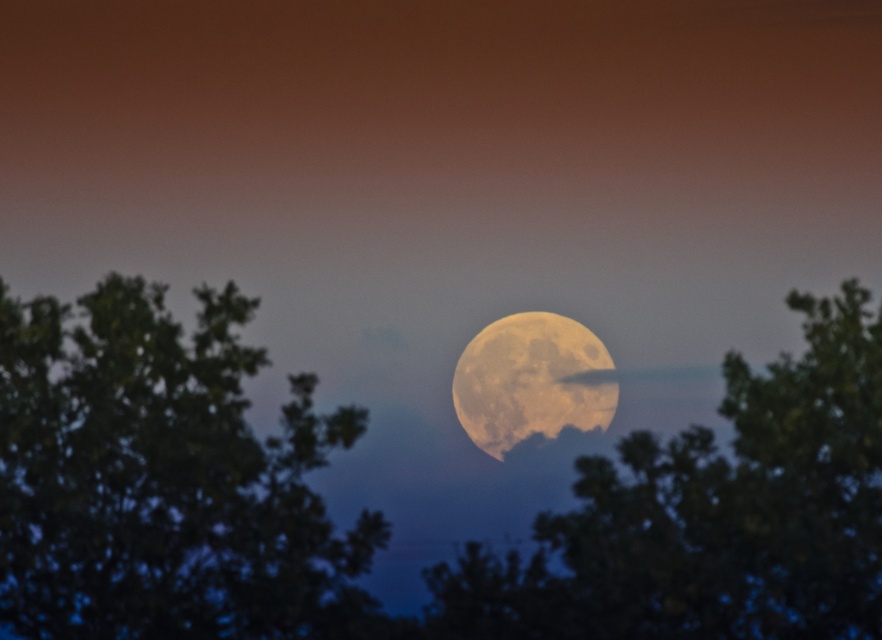
Question: Does green leafy tree at left appear over green leafy tree at center?

Choices:
 (A) no
 (B) yes

Answer: (B)

Question: Which point is closer to the camera?

Choices:
 (A) green leafy tree at center
 (B) golden textured moon at center

Answer: (A)

Question: Which point is closer to the camera?

Choices:
 (A) green leafy tree at left
 (B) golden textured moon at center
 (C) green leafy tree at center

Answer: (A)

Question: Estimate the real-world distances between objects in this image. Which object is farther from the green leafy tree at center?

Choices:
 (A) green leafy tree at left
 (B) golden textured moon at center

Answer: (B)

Question: Is green leafy tree at left positioned at the back of golden textured moon at center?

Choices:
 (A) no
 (B) yes

Answer: (A)

Question: Does green leafy tree at left appear over golden textured moon at center?

Choices:
 (A) yes
 (B) no

Answer: (B)